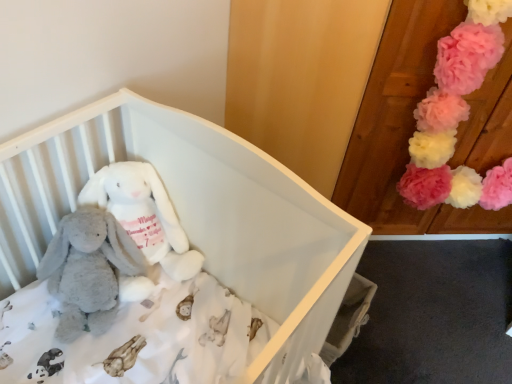
Question: In which direction should I rotate to look at soft plush bunny at center, placed as the 2th toy when sorted from left to right?

Choices:
 (A) left
 (B) right

Answer: (A)

Question: Can you confirm if white plush infant bed at center is positioned to the left of fluffy pink pom-poms at upper right, placed as the first toy when sorted from right to left?

Choices:
 (A) yes
 (B) no

Answer: (A)

Question: Can you confirm if white plush infant bed at center is wider than fluffy pink pom-poms at upper right, which is the third toy from left to right?

Choices:
 (A) no
 (B) yes

Answer: (B)

Question: Can you confirm if white plush infant bed at center is positioned to the right of fluffy pink pom-poms at upper right, which is the third toy from left to right?

Choices:
 (A) yes
 (B) no

Answer: (B)

Question: Is white plush infant bed at center positioned behind fluffy pink pom-poms at upper right, which is the third toy from left to right?

Choices:
 (A) no
 (B) yes

Answer: (A)

Question: From the image's perspective, is white plush infant bed at center located above fluffy pink pom-poms at upper right, which is the third toy from left to right?

Choices:
 (A) yes
 (B) no

Answer: (B)

Question: Are white plush infant bed at center and fluffy pink pom-poms at upper right, placed as the first toy when sorted from right to left, making contact?

Choices:
 (A) no
 (B) yes

Answer: (A)

Question: Does fluffy pink pom-poms at upper right, placed as the first toy when sorted from right to left, have a greater height compared to white plush infant bed at center?

Choices:
 (A) no
 (B) yes

Answer: (A)

Question: Is fluffy pink pom-poms at upper right, which is the third toy from left to right, positioned beyond the bounds of white plush infant bed at center?

Choices:
 (A) yes
 (B) no

Answer: (A)

Question: Can you confirm if fluffy pink pom-poms at upper right, which is the third toy from left to right, is wider than white plush infant bed at center?

Choices:
 (A) no
 (B) yes

Answer: (A)

Question: From the image's perspective, is fluffy pink pom-poms at upper right, placed as the first toy when sorted from right to left, below white plush infant bed at center?

Choices:
 (A) yes
 (B) no

Answer: (B)

Question: Does fluffy pink pom-poms at upper right, which is the third toy from left to right, have a lesser width compared to white plush infant bed at center?

Choices:
 (A) yes
 (B) no

Answer: (A)

Question: Considering the relative positions of fluffy pink pom-poms at upper right, placed as the first toy when sorted from right to left, and white plush infant bed at center in the image provided, is fluffy pink pom-poms at upper right, placed as the first toy when sorted from right to left, to the right of white plush infant bed at center from the viewer's perspective?

Choices:
 (A) yes
 (B) no

Answer: (A)

Question: Does white plush infant bed at center have a smaller size compared to soft plush bunny at center, placed as the 2th toy when sorted from left to right?

Choices:
 (A) yes
 (B) no

Answer: (B)